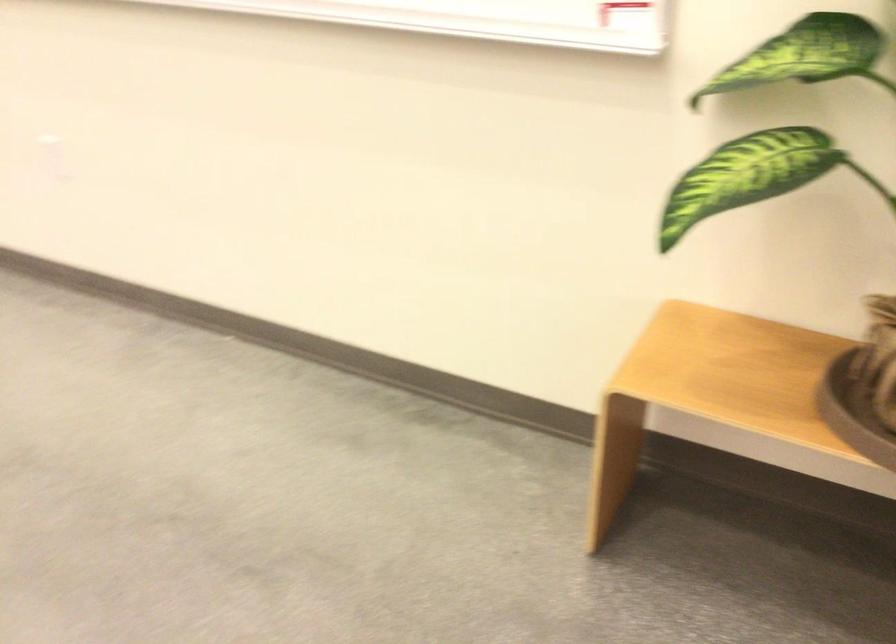
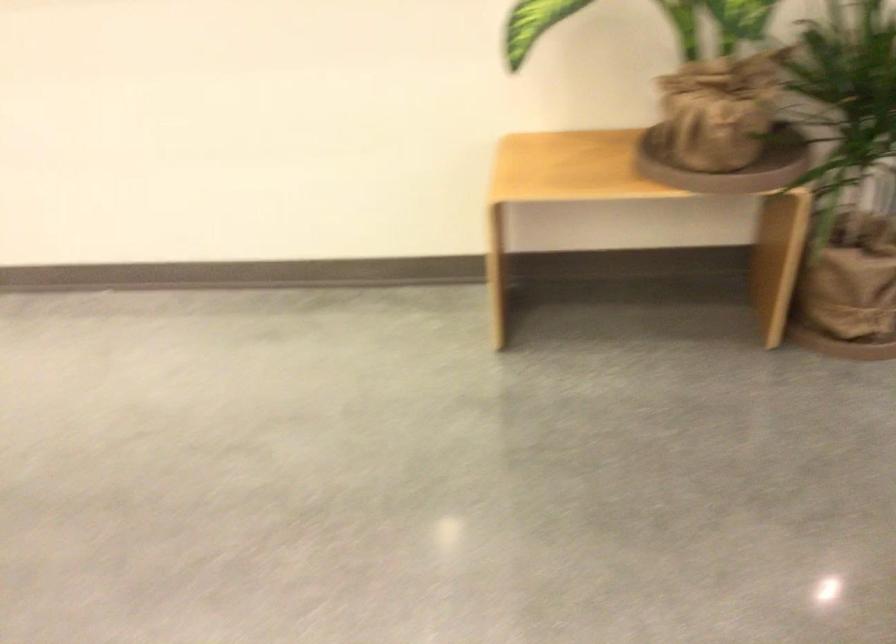
Question: The camera is either moving clockwise (left) or counter-clockwise (right) around the object. The first image is from the beginning of the video and the second image is from the end. Is the camera moving left or right when shooting the video?

Choices:
 (A) Left
 (B) Right

Answer: (A)